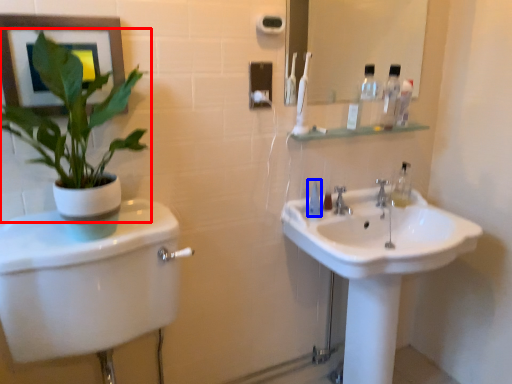
Question: Which of the following is the closest to the observer, houseplant (highlighted by a red box) or mouthwash (highlighted by a blue box)?

Choices:
 (A) houseplant
 (B) mouthwash

Answer: (A)